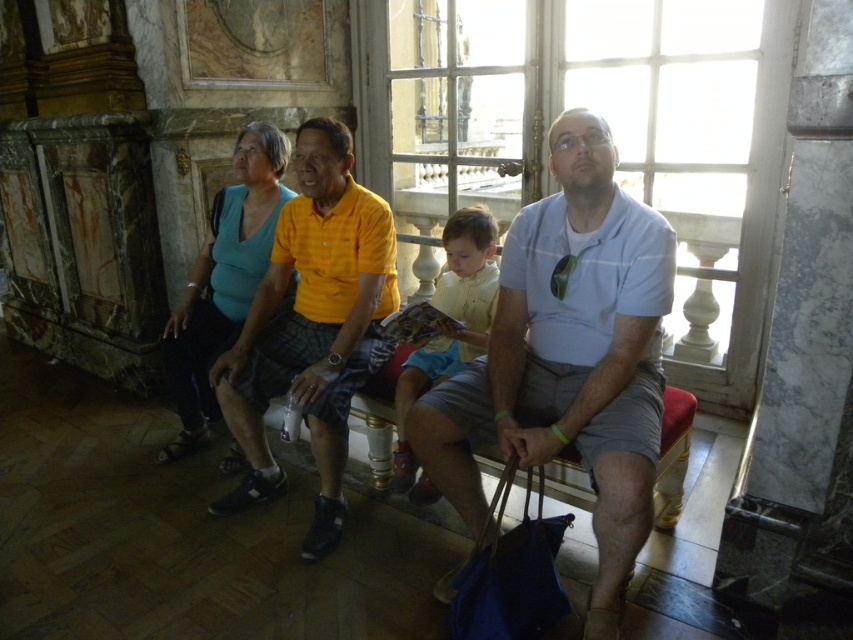
Question: Where is teal fabric shirt at center located in relation to yellow cotton shirt at center in the image?

Choices:
 (A) left
 (B) right

Answer: (A)

Question: Can you confirm if matte yellow shirt at center is bigger than yellow cotton shirt at center?

Choices:
 (A) no
 (B) yes

Answer: (B)

Question: Is light blue cotton shirt at center further to camera compared to teal fabric shirt at center?

Choices:
 (A) yes
 (B) no

Answer: (B)

Question: Which of these objects is positioned closest to the matte yellow shirt at center?

Choices:
 (A) teal fabric shirt at center
 (B) light blue cotton shirt at center

Answer: (A)

Question: Which of the following is the closest to the observer?

Choices:
 (A) (618, 310)
 (B) (254, 490)
 (C) (405, 460)

Answer: (A)

Question: Which object appears farthest from the camera in this image?

Choices:
 (A) teal fabric shirt at center
 (B) matte yellow shirt at center
 (C) light blue cotton shirt at center

Answer: (A)